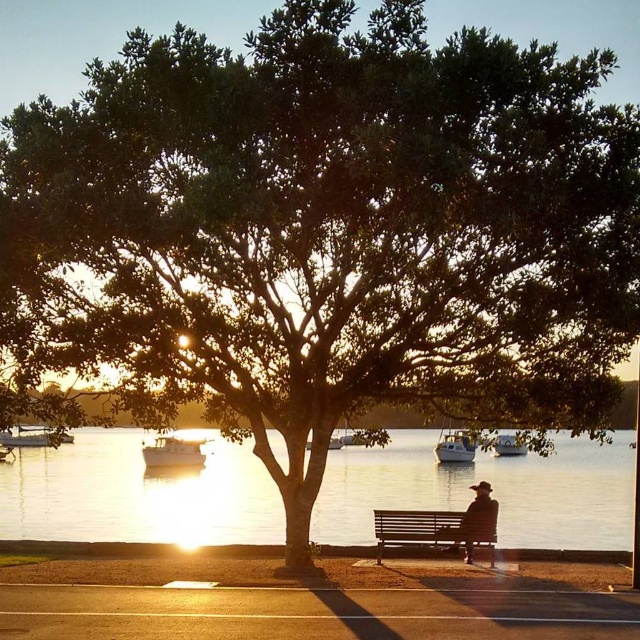
Question: Does wooden bench at center appear under metallic silver boat at lower left?

Choices:
 (A) no
 (B) yes

Answer: (B)

Question: Among these objects, which one is farthest from the camera?

Choices:
 (A) silhouette hat at center
 (B) metallic silver boat at center
 (C) white wooden boat at lower left

Answer: (B)

Question: Estimate the real-world distances between objects in this image. Which object is farther from the wooden bench at center?

Choices:
 (A) white plastic boat at center
 (B) metallic silver boat at lower left
 (C) metallic blue boat at center
 (D) white wooden boat at lower left

Answer: (B)

Question: Does glistening water at center lie in front of white wooden boat at lower left?

Choices:
 (A) yes
 (B) no

Answer: (B)

Question: Among these objects, which one is farthest from the camera?

Choices:
 (A) metallic blue boat at center
 (B) metallic silver boat at lower left

Answer: (B)

Question: In this image, where is glistening water at center located relative to wooden bench at center?

Choices:
 (A) below
 (B) above

Answer: (A)